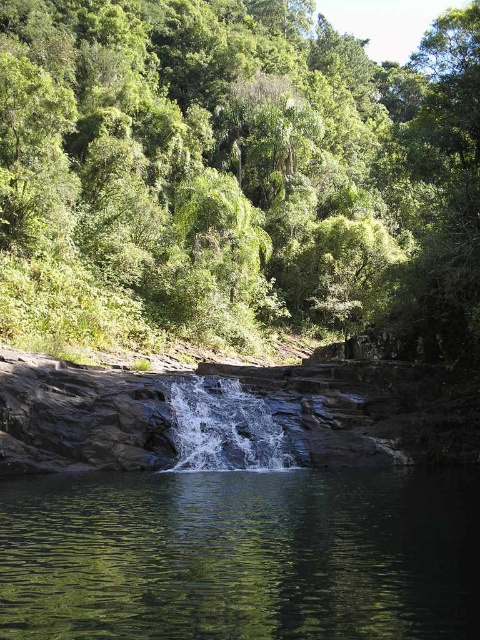
Question: Which object is the closest to the green reflective water at center?

Choices:
 (A) green leafy tree at upper center
 (B) white frothy water at center

Answer: (B)

Question: Which of the following is the closest to the observer?

Choices:
 (A) (149, 490)
 (B) (243, 390)

Answer: (A)

Question: Is green leafy tree at upper center behind white frothy water at center?

Choices:
 (A) no
 (B) yes

Answer: (B)

Question: Where is green reflective water at center located in relation to white frothy water at center in the image?

Choices:
 (A) below
 (B) above

Answer: (B)

Question: Can you confirm if green reflective water at center is bigger than white frothy water at center?

Choices:
 (A) no
 (B) yes

Answer: (B)

Question: Which point is closer to the camera taking this photo?

Choices:
 (A) (236, 444)
 (B) (407, 502)
 (C) (327, 60)

Answer: (B)